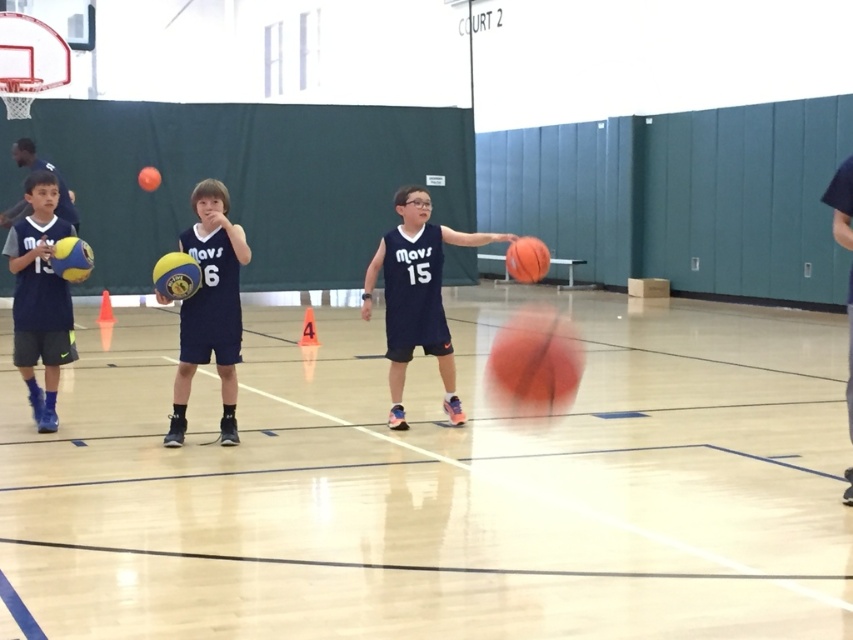
You are a coach observing the practice session on COURT 2. You notice the glossy blue jersey at center and the matte yellow basketball at left. Which object appears larger in size?

The matte yellow basketball at left appears larger in size than the glossy blue jersey at center.

You are standing at the center of the basketball court and looking towards the hoop. There are two points marked on the floor labeled as point (213, 262) and point (39, 212). Which point is closer to you?

Point (213, 262) is closer to the camera than point (39, 212), so the point closer to you is point (213, 262).